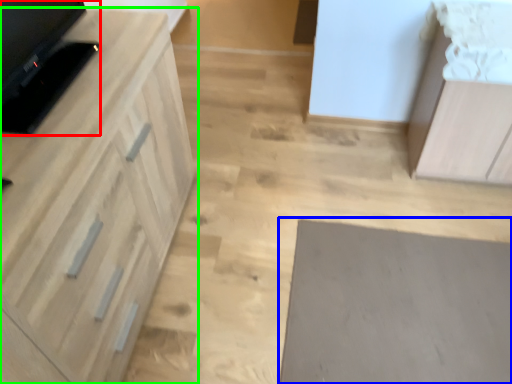
Question: Estimate the real-world distances between objects in this image. Which object is farther from appliance (highlighted by a red box), mat (highlighted by a blue box) or cabinetry (highlighted by a green box)?

Choices:
 (A) mat
 (B) cabinetry

Answer: (A)